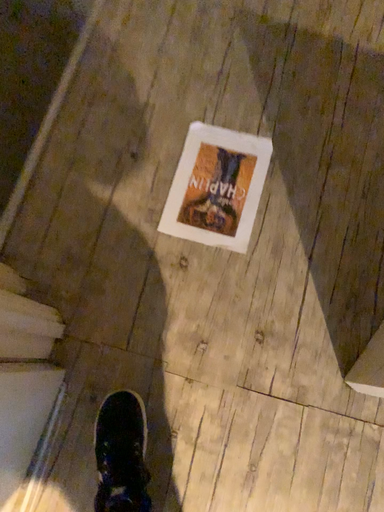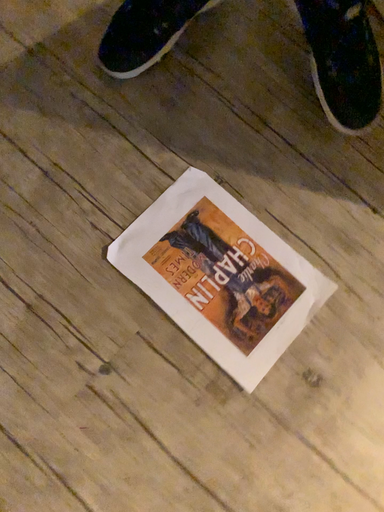
Question: How did the camera likely rotate when shooting the video?

Choices:
 (A) rotated upward
 (B) rotated downward

Answer: (A)